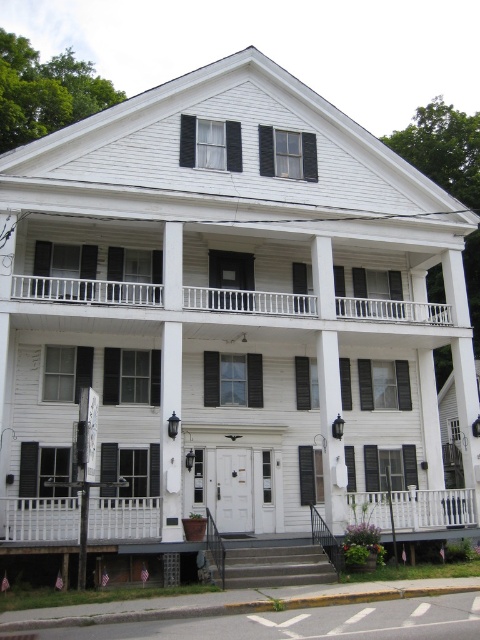
Can you confirm if white wooden porch at upper center is positioned above white painted wood balustrade at lower center?

Indeed, white wooden porch at upper center is positioned over white painted wood balustrade at lower center.

Who is lower down, white wooden porch at upper center or white painted wood balustrade at lower center?

white painted wood balustrade at lower center

Describe the element at coordinates (85, 291) in the screenshot. I see `white wooden porch at upper center` at that location.

This screenshot has height=640, width=480. I want to click on white wooden porch at upper center, so click(x=85, y=291).

Does white painted wood balustrade at lower center appear under black wood shutter at center?

Correct, white painted wood balustrade at lower center is located below black wood shutter at center.

Is point (21, 540) closer to viewer compared to point (116, 449)?

That is True.

Who is more distant from viewer, (112, 500) or (103, 488)?

The point (103, 488) is behind.

What are the coordinates of `white painted wood balustrade at lower center` in the screenshot? It's located at (39, 518).

Which of these two, white wooden porch at upper center or black wood shutter at center, stands shorter?

With less height is white wooden porch at upper center.

Is white wooden porch at upper center positioned behind black wood shutter at center?

No, it is not.

Is point (44, 276) farther from camera compared to point (108, 452)?

That is True.

At what (x,y) coordinates should I click in order to perform the action: click on white wooden porch at upper center. Please return your answer as a coordinate pair (x, y). The width and height of the screenshot is (480, 640). Looking at the image, I should click on (85, 291).